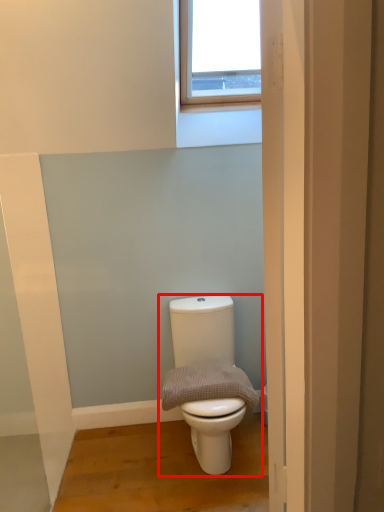
Question: From the image's perspective, where is toilet (annotated by the red box) located in relation to gray in the image?

Choices:
 (A) above
 (B) below

Answer: (B)